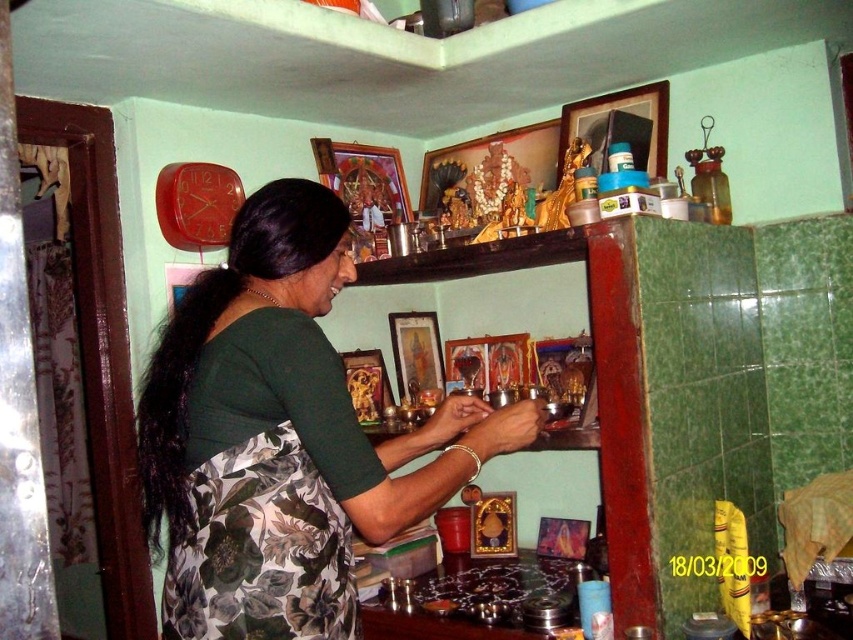
Question: Considering the relative positions of green fabric sari at center and floral fabric apron at lower left in the image provided, where is green fabric sari at center located with respect to floral fabric apron at lower left?

Choices:
 (A) left
 (B) right

Answer: (B)

Question: Which point is farther to the camera?

Choices:
 (A) floral fabric apron at lower left
 (B) green fabric sari at center

Answer: (A)

Question: Which point is closer to the camera?

Choices:
 (A) coord(183,612)
 (B) coord(282,470)

Answer: (B)

Question: Is green fabric sari at center further to the viewer compared to floral fabric apron at lower left?

Choices:
 (A) no
 (B) yes

Answer: (A)

Question: Among these objects, which one is nearest to the camera?

Choices:
 (A) floral fabric apron at lower left
 (B) green fabric sari at center

Answer: (B)

Question: Can you confirm if green fabric sari at center is positioned below floral fabric apron at lower left?

Choices:
 (A) yes
 (B) no

Answer: (B)